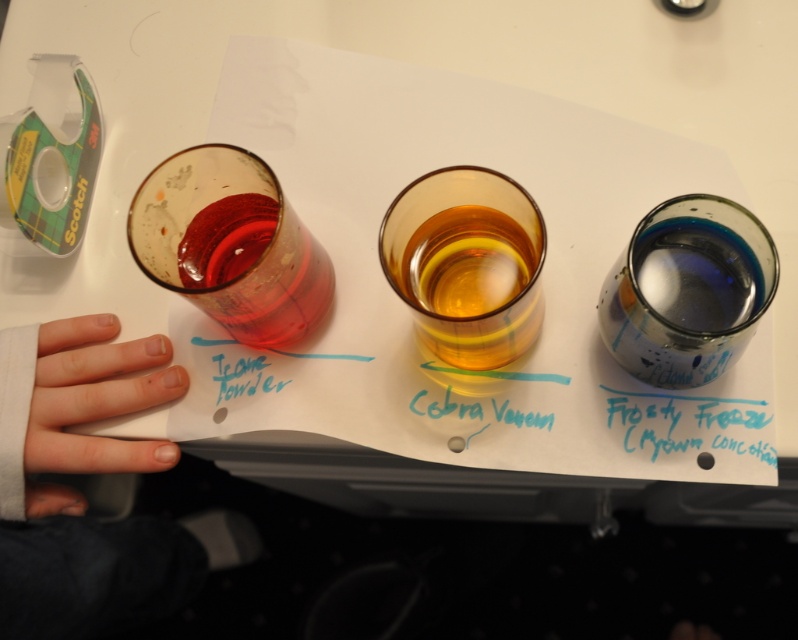
Question: Which object is the closest to the cobra venom at center?

Choices:
 (A) amber glass at center
 (B) white fabric hand at lower left

Answer: (A)

Question: Does amber glass at center appear over frosty freeze material/texture at position?

Choices:
 (A) yes
 (B) no

Answer: (A)

Question: Can you confirm if amber glass at center is positioned below pale skin at lower left?

Choices:
 (A) yes
 (B) no

Answer: (B)

Question: Does amber glass at center lie behind teal matte powder at upper left?

Choices:
 (A) no
 (B) yes

Answer: (A)

Question: Based on their relative distances, which object is farther from the white fabric hand at lower left?

Choices:
 (A) amber glass at center
 (B) cobra venom at center

Answer: (B)

Question: Which of the following is the closest to the observer?

Choices:
 (A) (492, 408)
 (B) (646, 365)
 (C) (113, 365)
 (D) (261, 369)

Answer: (B)